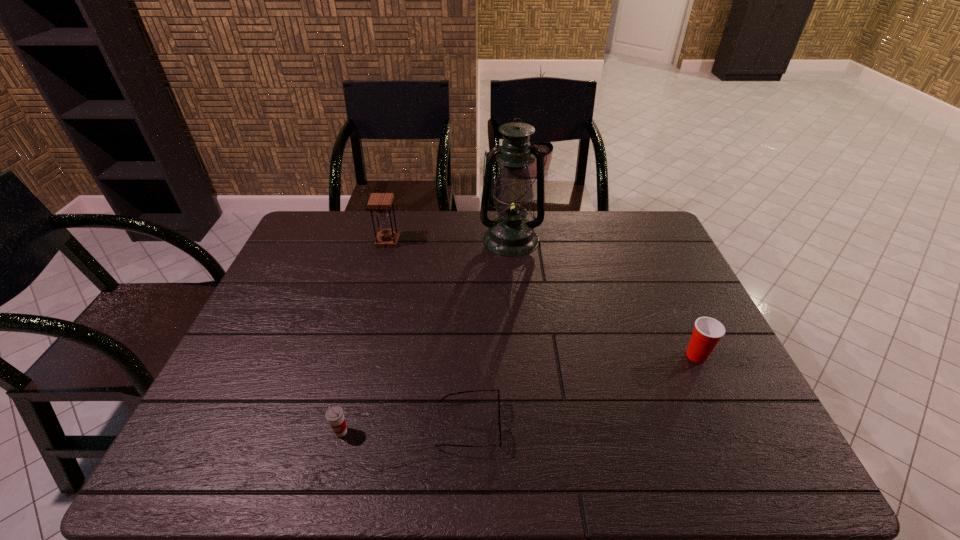
Where is `vacant position at the far left corner of the desktop`? Image resolution: width=960 pixels, height=540 pixels. vacant position at the far left corner of the desktop is located at coordinates (334, 221).

In the image, there is a desktop. Where is `vacant space at the near left corner`? The height and width of the screenshot is (540, 960). vacant space at the near left corner is located at coordinates (238, 444).

Where is `free space at the far right corner`? This screenshot has height=540, width=960. free space at the far right corner is located at coordinates (636, 230).

Locate an element on the screen. unoccupied position between the rightmost object and the fourth shortest object is located at coordinates (542, 299).

You are a GUI agent. You are given a task and a screenshot of the screen. Output one action in this format:
    pyautogui.click(x=<x>, y=<y>)
    Task: Click on the vacant area that lies between the rightmost object and the cup
    This screenshot has height=540, width=960.
    Given the screenshot: What is the action you would take?
    pyautogui.click(x=518, y=394)

You are a GUI agent. You are given a task and a screenshot of the screen. Output one action in this format:
    pyautogui.click(x=<x>, y=<y>)
    Task: Click on the blank region between the hourglass and the tallest object
    
    Given the screenshot: What is the action you would take?
    tap(449, 240)

At what (x,y) coordinates should I click in order to perform the action: click on free space that is in between the tallest object and the rightmost object. Please return your answer as a coordinate pair (x, y). Looking at the image, I should click on (604, 298).

The height and width of the screenshot is (540, 960). In order to click on empty location between the fourth shortest object and the tallest object in this screenshot , I will do `click(449, 240)`.

This screenshot has width=960, height=540. Identify the location of vacant space that is in between the tallest object and the Dixie cup. (604, 298).

The width and height of the screenshot is (960, 540). Find the location of `vacant space that is in between the cup and the tallest object`. vacant space that is in between the cup and the tallest object is located at coordinates (426, 336).